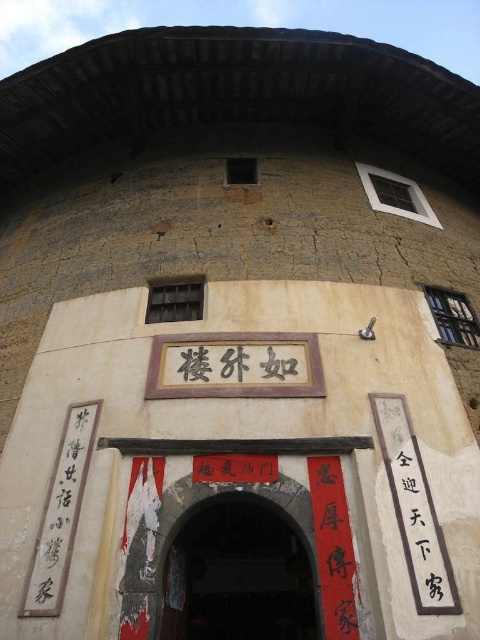
You are a visitor approaching the entrance of the Tulou. You notice both the dark brown wooden door at center and the black wood sign at center. Which object is narrower when viewed from the front?

The dark brown wooden door at center is thinner than the black wood sign at center, so the dark brown wooden door at center is narrower when viewed from the front.

You are a tourist standing in front of the Tulou building and want to read both the black wood sign at center and the black calligraphy at right. Which one is bigger?

The black wood sign at center has a larger size compared to the black calligraphy at right, so the black wood sign at center is bigger.

You are standing in front of the Tulou and want to enter through the dark brown wooden door at center. If you are at the origin point, which is the coordinate of the door?

The dark brown wooden door at center is located at coordinate point (238, 573).